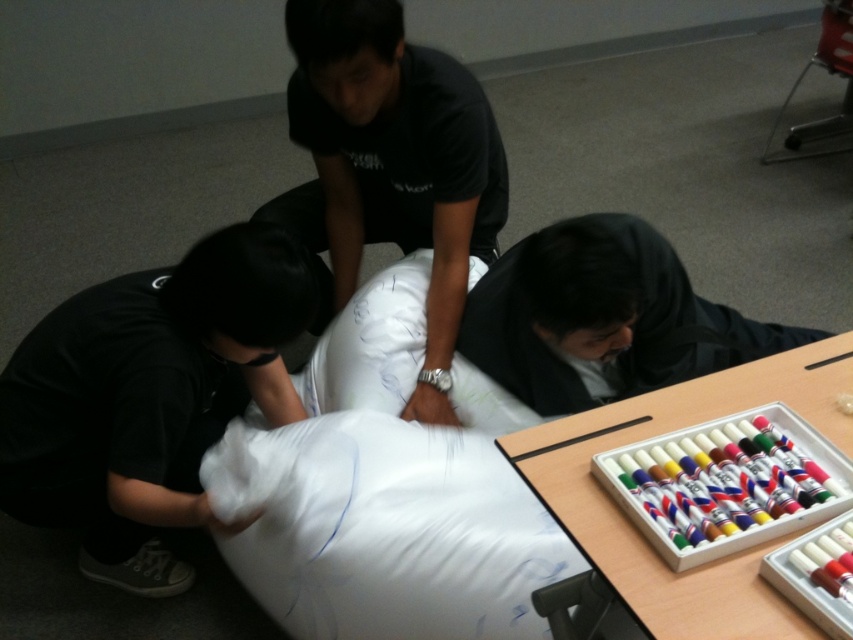
Question: Is black matte shirt at center bigger than wooden table at lower right?

Choices:
 (A) yes
 (B) no

Answer: (A)

Question: Among these objects, which one is nearest to the camera?

Choices:
 (A) wooden table at lower right
 (B) black matte shirt at center
 (C) black matte pillow at lower left

Answer: (A)

Question: Based on their relative distances, which object is farther from the black matte shirt at center?

Choices:
 (A) wooden table at lower right
 (B) black matte pillow at lower left

Answer: (A)

Question: Is black matte shirt at center behind wooden table at lower right?

Choices:
 (A) yes
 (B) no

Answer: (A)

Question: Can you confirm if black matte pillow at lower left is positioned to the left of wooden table at lower right?

Choices:
 (A) yes
 (B) no

Answer: (A)

Question: Estimate the real-world distances between objects in this image. Which object is farther from the black matte pillow at lower left?

Choices:
 (A) wooden table at lower right
 (B) black matte shirt at center

Answer: (A)